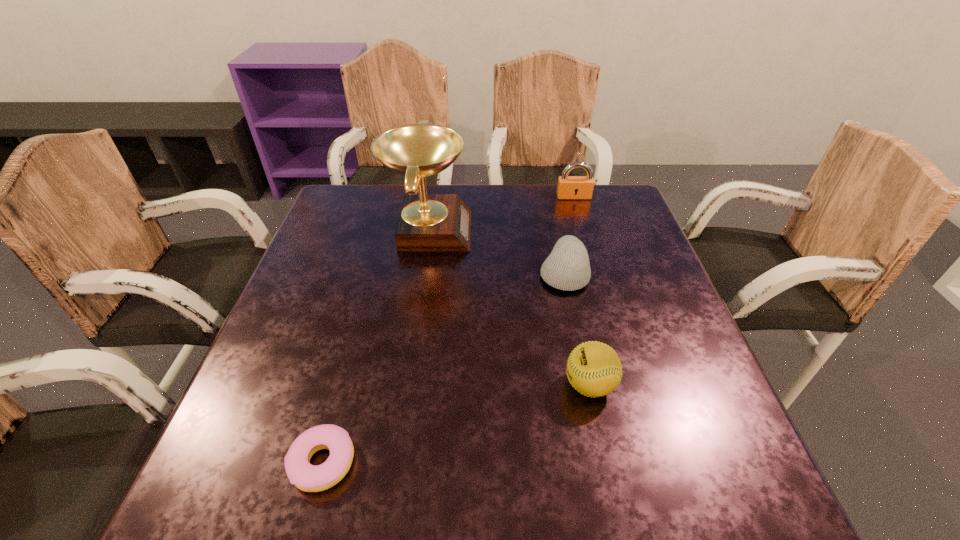
Where is `the tallest object`? This screenshot has width=960, height=540. the tallest object is located at coordinates (427, 222).

Locate an element on the screen. This screenshot has height=540, width=960. the fourth shortest object is located at coordinates (569, 187).

This screenshot has width=960, height=540. I want to click on the fourth farthest object, so click(x=593, y=368).

Where is `beanie`? This screenshot has height=540, width=960. beanie is located at coordinates (567, 268).

I want to click on the nearest object, so click(x=310, y=478).

Identify the location of doughnut. (310, 478).

Identify the location of free space located 0.360m on the front-facing side of the tallest object. This screenshot has height=540, width=960. (601, 230).

Locate an element on the screen. This screenshot has width=960, height=540. blank space located 0.370m to unlock the second tallest object from the front is located at coordinates (599, 284).

Find the location of `free point located on the logo side of the softball`. free point located on the logo side of the softball is located at coordinates (443, 385).

What are the coordinates of `blank space located 0.400m on the logo side of the softball` in the screenshot? It's located at (354, 385).